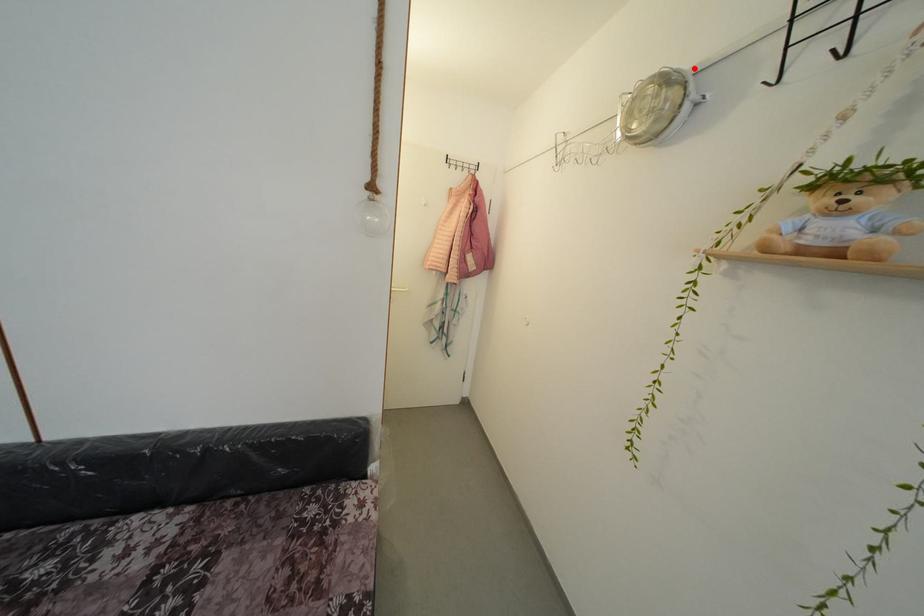
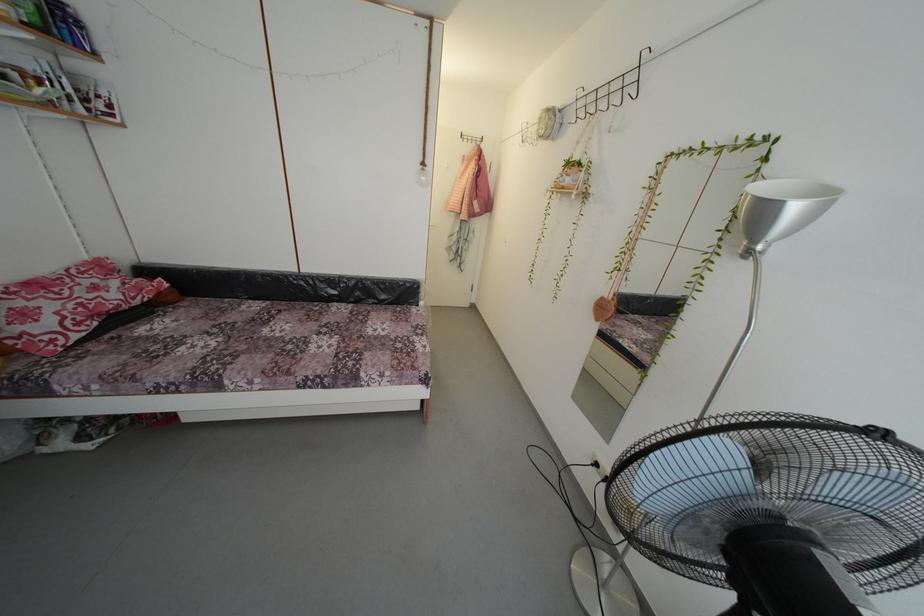
Find the pixel in the second image that matches the highlighted location in the first image.

(564, 111)